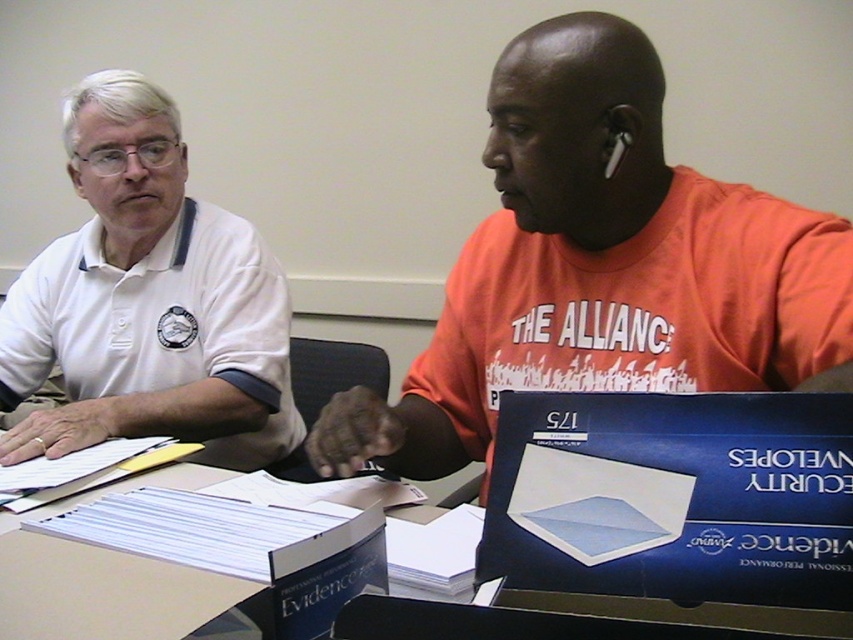
Question: Which point appears closest to the camera in this image?

Choices:
 (A) (207, 294)
 (B) (440, 323)

Answer: (B)

Question: Which object is farther from the camera taking this photo?

Choices:
 (A) white matte shirt at left
 (B) orange t-shirt at center

Answer: (A)

Question: Is orange t-shirt at center above white matte shirt at left?

Choices:
 (A) yes
 (B) no

Answer: (B)

Question: Is orange t-shirt at center smaller than white matte shirt at left?

Choices:
 (A) yes
 (B) no

Answer: (A)

Question: Observing the image, what is the correct spatial positioning of orange t-shirt at center in reference to white matte shirt at left?

Choices:
 (A) above
 (B) below

Answer: (B)